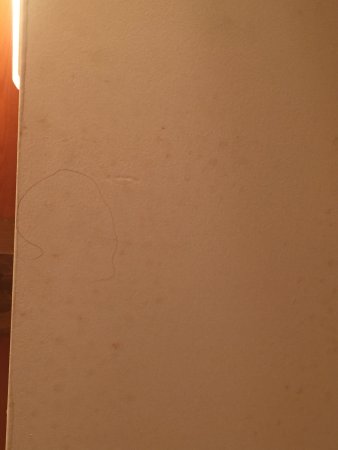
Identify the location of surface. (8, 128).